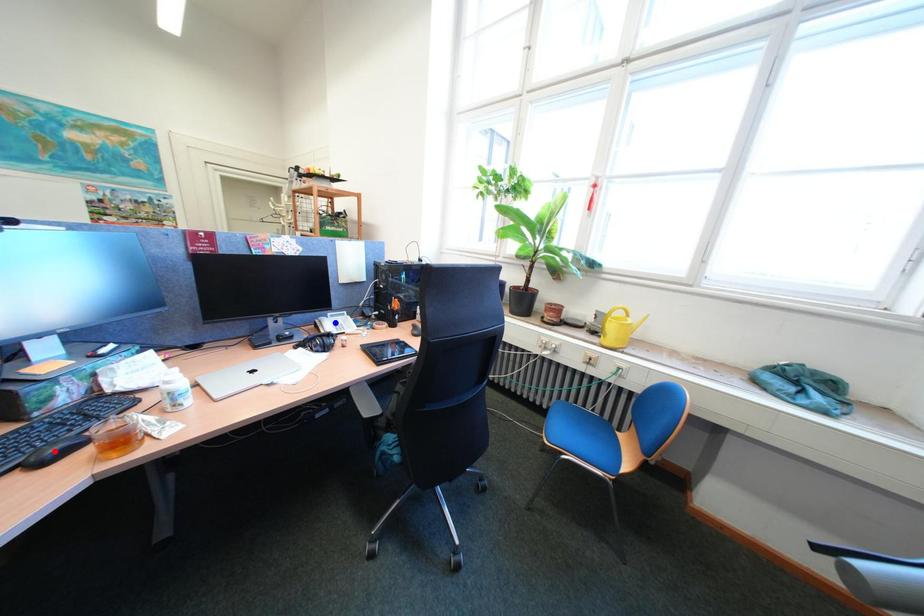
Question: Which of the two points in the image is closer to the camera?

Choices:
 (A) Blue point is closer.
 (B) Red point is closer.

Answer: (B)